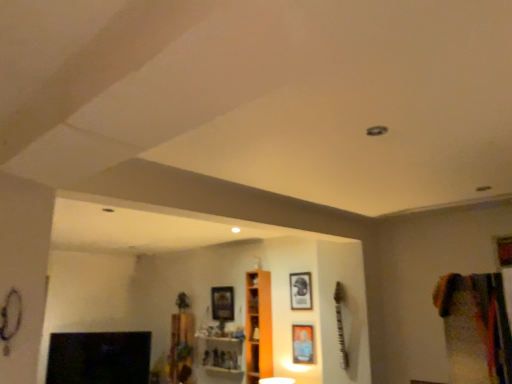
Question: Is point (246, 342) positioned closer to the camera than point (217, 360)?

Choices:
 (A) farther
 (B) closer

Answer: (B)

Question: Considering the relative positions of orange wood cabinet at center and wooden shelf at center, placed as the second shelf when sorted from left to right, in the image provided, is orange wood cabinet at center to the left or to the right of wooden shelf at center, placed as the second shelf when sorted from left to right,?

Choices:
 (A) right
 (B) left

Answer: (A)

Question: Considering the real-world distances, which object is farthest from the wooden picture frame at center, the 1th picture frame positioned from the back?

Choices:
 (A) black glossy fireplace at lower left
 (B) wooden shelf at center, placed as the second shelf when sorted from left to right
 (C) wooden shelf at center, acting as the first shelf starting from the left
 (D) multicolored fabric at right
 (E) metallic silver picture frame at center, positioned as the second picture frame in right-to-left order

Answer: (D)

Question: Estimate the real-world distances between objects in this image. Which object is closer to the orange wood cabinet at center?

Choices:
 (A) metallic silver picture frame at center, positioned as the second picture frame in right-to-left order
 (B) wooden picture frame at center, the 3th picture frame in the front-to-back sequence
 (C) wooden shelf at center, acting as the first shelf starting from the left
 (D) black glossy fireplace at lower left
 (E) matte black picture frame at center, acting as the second picture frame starting from the back

Answer: (A)